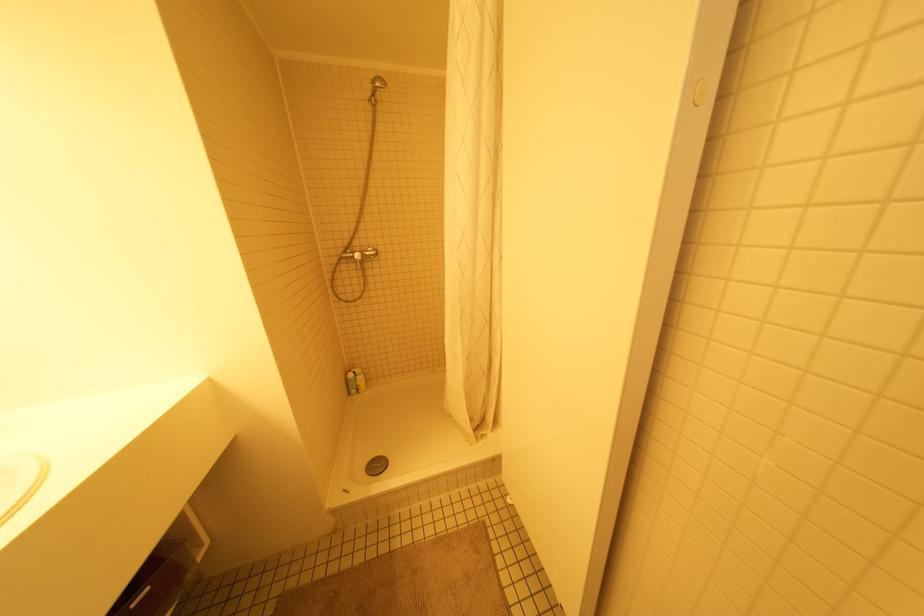
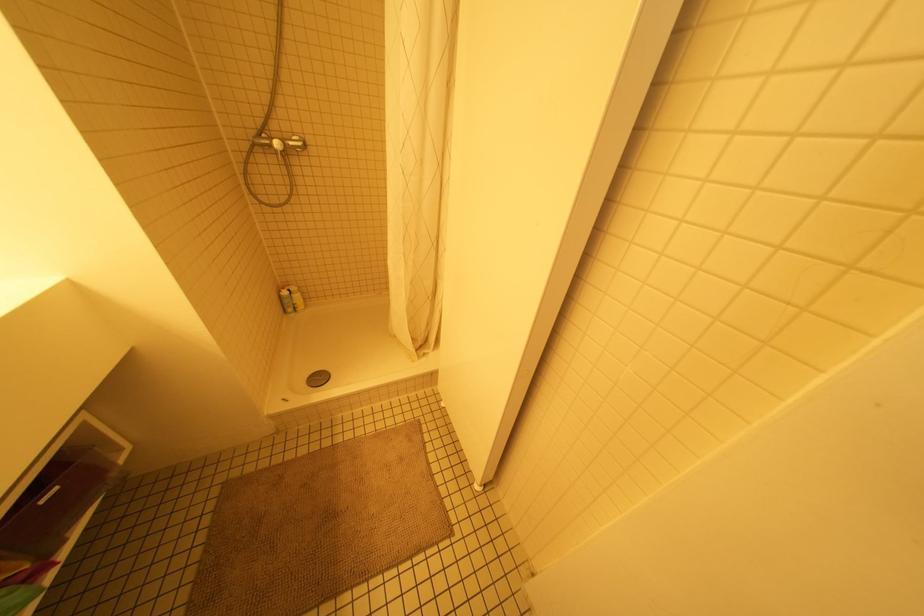
The point at [349,375] is marked in the first image. Where is the corresponding point in the second image?

(284, 292)